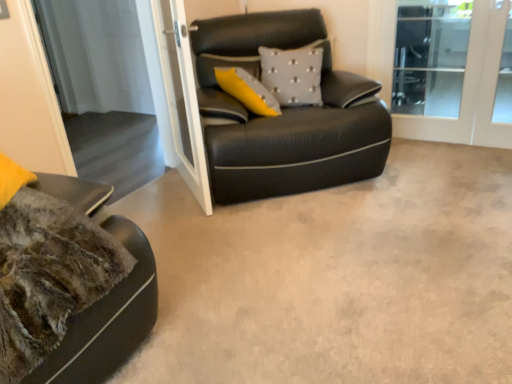
This screenshot has height=384, width=512. I want to click on empty space that is to the right of black leather studio couch at center, so click(x=441, y=173).